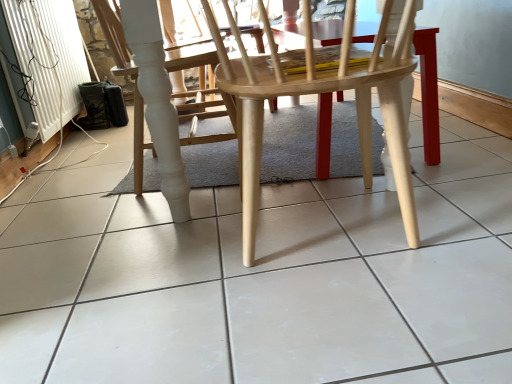
Question: Is white glossy tile at center positioned behind white glossy chair at center, the 2th chair in the right-to-left sequence?

Choices:
 (A) no
 (B) yes

Answer: (A)

Question: Considering the relative sizes of white glossy tile at center and white glossy chair at center, the 2th chair in the right-to-left sequence, in the image provided, is white glossy tile at center wider than white glossy chair at center, the 2th chair in the right-to-left sequence,?

Choices:
 (A) no
 (B) yes

Answer: (B)

Question: Is white glossy tile at center outside of white glossy chair at center, the 2th chair in the right-to-left sequence?

Choices:
 (A) yes
 (B) no

Answer: (A)

Question: Considering the relative sizes of white glossy tile at center and white glossy chair at center, arranged as the second chair when viewed from the front, in the image provided, is white glossy tile at center shorter than white glossy chair at center, arranged as the second chair when viewed from the front,?

Choices:
 (A) no
 (B) yes

Answer: (B)

Question: Is white glossy tile at center at the left side of white glossy chair at center, the first chair viewed from the back?

Choices:
 (A) no
 (B) yes

Answer: (A)

Question: In the image, is white textured radiator at lower left positioned in front of or behind white glossy tile at center?

Choices:
 (A) front
 (B) behind

Answer: (B)

Question: From a real-world perspective, is white textured radiator at lower left physically located above or below white glossy tile at center?

Choices:
 (A) below
 (B) above

Answer: (B)

Question: Is white textured radiator at lower left taller or shorter than white glossy tile at center?

Choices:
 (A) short
 (B) tall

Answer: (B)

Question: Based on their sizes in the image, would you say white textured radiator at lower left is bigger or smaller than white glossy tile at center?

Choices:
 (A) small
 (B) big

Answer: (A)

Question: Is white glossy tile at center inside the boundaries of white textured radiator at lower left, or outside?

Choices:
 (A) outside
 (B) inside

Answer: (A)

Question: Based on their positions, is white glossy tile at center located to the left or right of white textured radiator at lower left?

Choices:
 (A) left
 (B) right

Answer: (B)

Question: From a real-world perspective, relative to white textured radiator at lower left, is white glossy tile at center vertically above or below?

Choices:
 (A) below
 (B) above

Answer: (A)

Question: Considering the positions of white glossy tile at center and white textured radiator at lower left in the image, is white glossy tile at center bigger or smaller than white textured radiator at lower left?

Choices:
 (A) big
 (B) small

Answer: (A)

Question: Relative to white glossy tile at center, is natural wood chair at center, the second chair when ordered from left to right, in front or behind?

Choices:
 (A) front
 (B) behind

Answer: (B)

Question: Would you say natural wood chair at center, placed as the second chair when sorted from back to front, is inside or outside white glossy tile at center?

Choices:
 (A) inside
 (B) outside

Answer: (B)